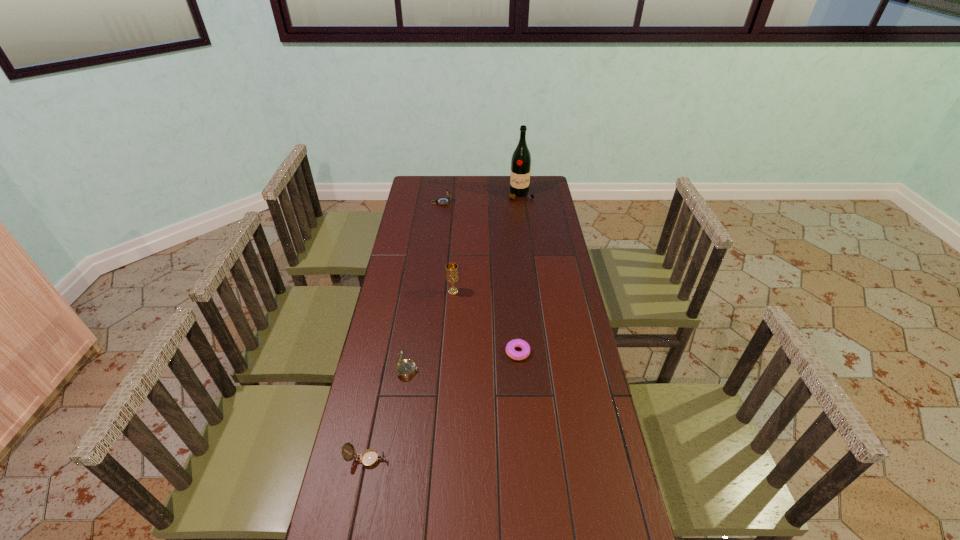
Point out which object is positioned as the nearest to the shortest object. Please provide its 2D coordinates. Your answer should be formatted as a tuple, i.e. [(x, y)], where the tuple contains the x and y coordinates of a point satisfying the conditions above.

[(405, 368)]

Where is `object that ranks as the fourth closest to the second nearest compass`? This screenshot has width=960, height=540. object that ranks as the fourth closest to the second nearest compass is located at coordinates (442, 200).

Image resolution: width=960 pixels, height=540 pixels. What are the coordinates of `compass identified as the second closest to the second farthest compass` in the screenshot? It's located at (442, 200).

Locate which compass ranks in proximity to the nearest compass. Please provide its 2D coordinates. Your answer should be formatted as a tuple, i.e. [(x, y)], where the tuple contains the x and y coordinates of a point satisfying the conditions above.

[(405, 368)]

I want to click on vacant space that satisfies the following two spatial constraints: 1. on the face of the shortest object; 2. on the right side of the farthest compass, so click(x=422, y=352).

The image size is (960, 540). Find the location of `free point that satisfies the following two spatial constraints: 1. on the back side of the shortest object; 2. on the face of the farthest compass`. free point that satisfies the following two spatial constraints: 1. on the back side of the shortest object; 2. on the face of the farthest compass is located at coordinates coord(505,202).

Identify the location of free spot that satisfies the following two spatial constraints: 1. on the surface of the wine bottle; 2. with the dial facing the second farthest compass. This screenshot has width=960, height=540. (544, 370).

You are a GUI agent. You are given a task and a screenshot of the screen. Output one action in this format:
    pyautogui.click(x=<x>, y=<y>)
    Task: Click on the free space that satisfies the following two spatial constraints: 1. on the surface of the tallest object; 2. with the dial facing the second farthest compass
    The height and width of the screenshot is (540, 960).
    Given the screenshot: What is the action you would take?
    pyautogui.click(x=544, y=370)

Identify the location of vacant space that satisfies the following two spatial constraints: 1. on the surface of the tallest object; 2. on the face of the nearest compass. The width and height of the screenshot is (960, 540). (556, 460).

This screenshot has height=540, width=960. I want to click on vacant space that satisfies the following two spatial constraints: 1. on the face of the shortest object; 2. on the right side of the farthest compass, so click(422, 352).